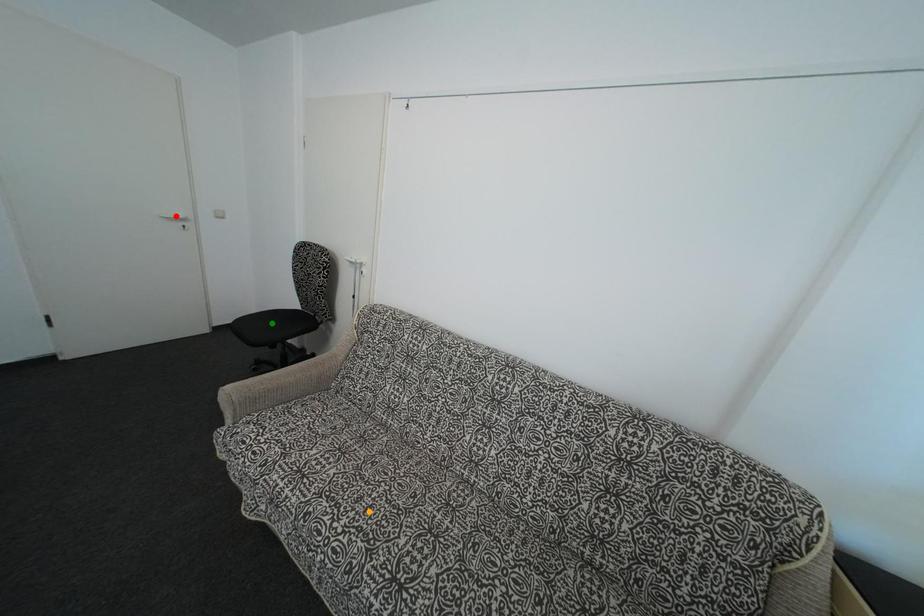
Order these from nearest to farthest:
red point, orange point, green point

orange point → green point → red point